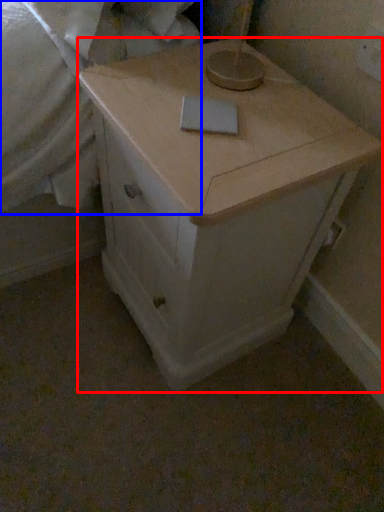
Question: Among these objects, which one is farthest to the camera, chest of drawers (highlighted by a red box) or sheet (highlighted by a blue box)?

Choices:
 (A) chest of drawers
 (B) sheet

Answer: (B)